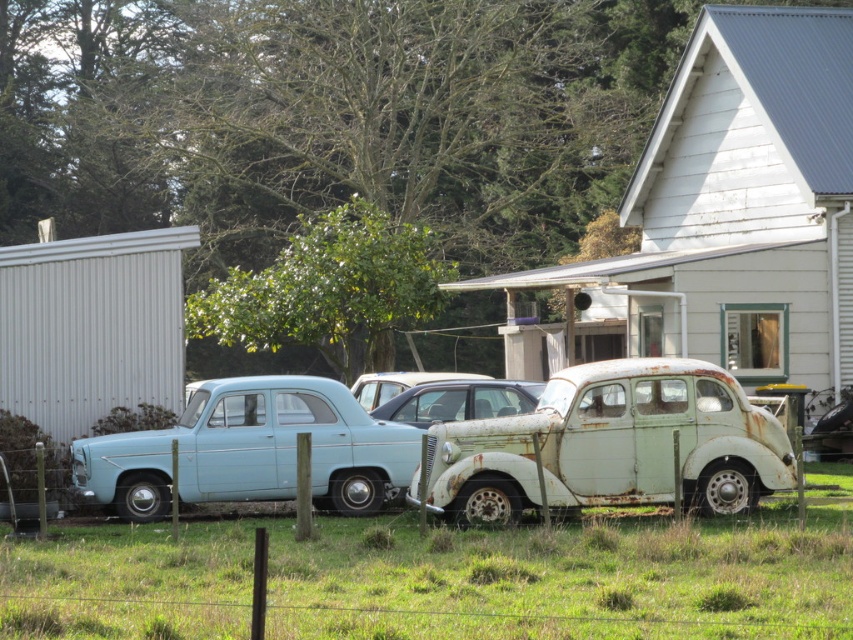
Find the location of a particular element. green grass at lower center is located at coordinates (440, 579).

Can you confirm if green grass at lower center is positioned to the right of rusty metal pickup truck at center?

No, green grass at lower center is not to the right of rusty metal pickup truck at center.

This screenshot has height=640, width=853. What are the coordinates of `green grass at lower center` in the screenshot? It's located at (440, 579).

The image size is (853, 640). I want to click on green grass at lower center, so click(x=440, y=579).

Can you confirm if light blue matte sedan at center is positioned to the right of rusty metal car at center?

Incorrect, light blue matte sedan at center is not on the right side of rusty metal car at center.

Who is shorter, light blue matte sedan at center or rusty metal car at center?

With less height is rusty metal car at center.

The width and height of the screenshot is (853, 640). What do you see at coordinates (251, 451) in the screenshot?
I see `light blue matte sedan at center` at bounding box center [251, 451].

Find the location of a particular element. This screenshot has height=640, width=853. light blue matte sedan at center is located at coordinates 251,451.

Does rusty metal pickup truck at center have a lesser width compared to light blue matte sedan at center?

Correct, rusty metal pickup truck at center's width is less than light blue matte sedan at center's.

Is rusty metal pickup truck at center shorter than light blue matte sedan at center?

Incorrect, rusty metal pickup truck at center's height does not fall short of light blue matte sedan at center's.

Describe the element at coordinates (610, 445) in the screenshot. The image size is (853, 640). I see `rusty metal pickup truck at center` at that location.

This screenshot has height=640, width=853. Find the location of `rusty metal pickup truck at center`. rusty metal pickup truck at center is located at coordinates (610, 445).